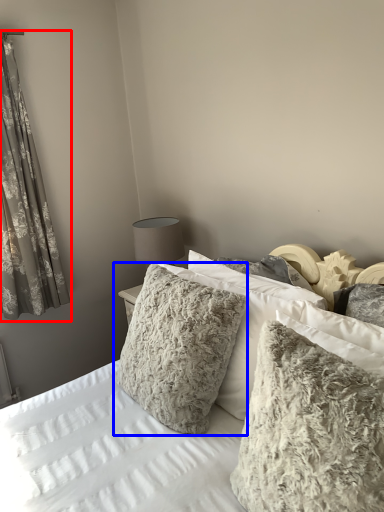
Question: Which object appears farthest to the camera in this image, curtain (highlighted by a red box) or pillow (highlighted by a blue box)?

Choices:
 (A) curtain
 (B) pillow

Answer: (A)